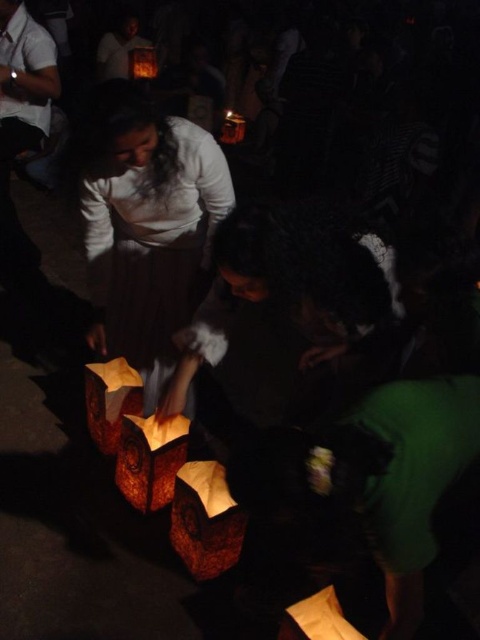
Looking at this image, you are a photographer trying to capture the perfect shot of the matte white blouse at center during the lantern event. Based on its position, where should you aim your camera to ensure it is centered in the frame?

The matte white blouse at center is located at the 2D coordinates point (147, 227), so you should aim your camera at that specific point to center it in the frame.